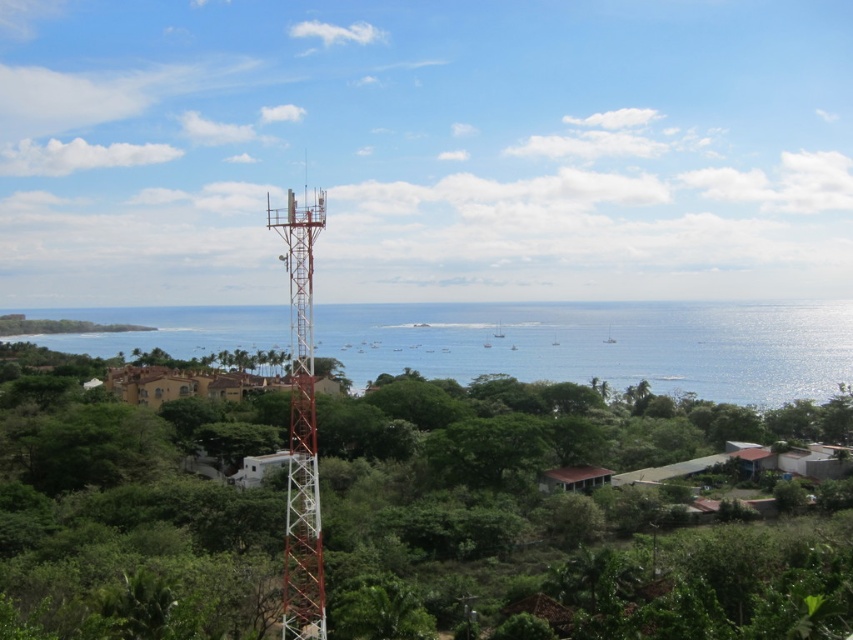
How far apart are blue water at center and rustic metal tower at center?

blue water at center is 311.37 meters from rustic metal tower at center.

Does blue water at center come in front of rustic metal tower at center?

No, it is not.

What do you see at coordinates (605, 344) in the screenshot? The image size is (853, 640). I see `blue water at center` at bounding box center [605, 344].

Identify the location of blue water at center. The width and height of the screenshot is (853, 640). (605, 344).

Is green leafy tree at center to the left of rustic metal tower at center from the viewer's perspective?

Indeed, green leafy tree at center is positioned on the left side of rustic metal tower at center.

Who is positioned more to the right, green leafy tree at center or rustic metal tower at center?

rustic metal tower at center is more to the right.

What do you see at coordinates (555, 513) in the screenshot? The width and height of the screenshot is (853, 640). I see `green leafy tree at center` at bounding box center [555, 513].

Where is `green leafy tree at center`? green leafy tree at center is located at coordinates (555, 513).

Does green leafy tree at center have a larger size compared to blue water at center?

Actually, green leafy tree at center might be smaller than blue water at center.

Can you confirm if green leafy tree at center is thinner than blue water at center?

Yes.

Does point (630, 593) come in front of point (364, 380)?

Yes, it is in front of point (364, 380).

You are a GUI agent. You are given a task and a screenshot of the screen. Output one action in this format:
    pyautogui.click(x=<x>, y=<y>)
    Task: Click on the green leafy tree at center
    Image resolution: width=853 pixels, height=640 pixels.
    Given the screenshot: What is the action you would take?
    pyautogui.click(x=555, y=513)